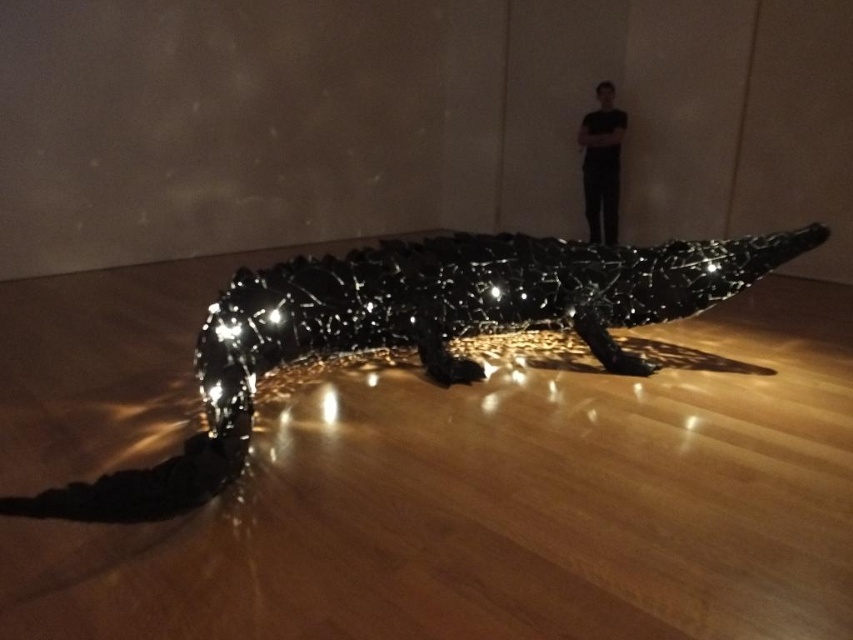
Identify the location of glossy black crocodile at center. The image size is (853, 640). (413, 330).

Locate an element on the screen. The height and width of the screenshot is (640, 853). glossy black crocodile at center is located at coordinates (413, 330).